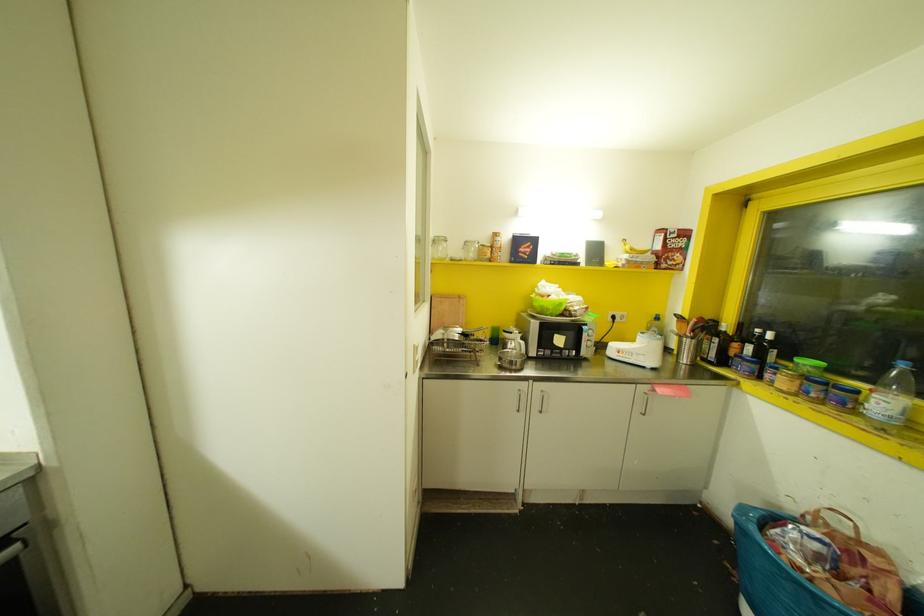
Which object does [891,398] point to?

It corresponds to the plastic water bottle in the image.